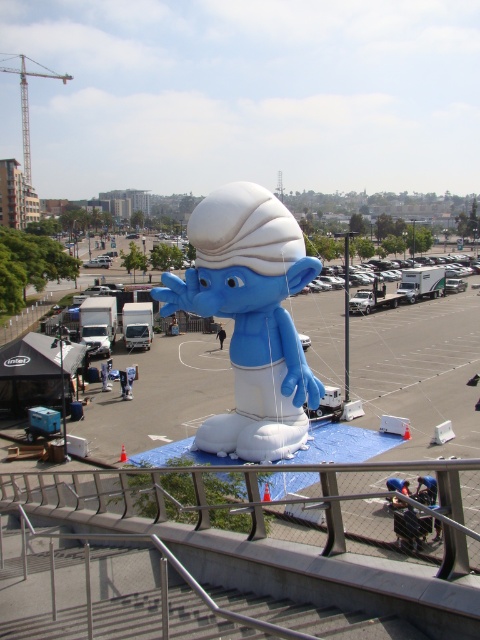
You are a maintenance worker at the event and need to attach a safety rope to the taller object between the satin silver railing at center and the blue inflatable smurf at center. Which object should you choose?

The satin silver railing at center is taller than the blue inflatable smurf at center, so you should attach the safety rope to the satin silver railing at center.

You are a guest at an event and want to take a photo with the blue inflatable smurf at center. However, you need to stand on the satin silver railing at center to get a better angle. Is the railing positioned in a way that allows you to do this?

The satin silver railing at center is positioned under the blue inflatable smurf at center, so standing on it would allow you to be directly underneath the smurf for a photo.

You are planning to place a new decorative item that is 1.5 meters wide in the center of the area. Considering the satin silver railing at center and the white matte inflatable at center, which object should you move to accommodate the new item?

The satin silver railing at center has a larger width than the white matte inflatable at center, so you should move the satin silver railing at center to accommodate the new decorative item.